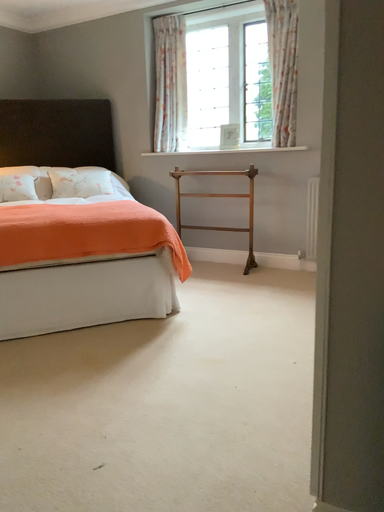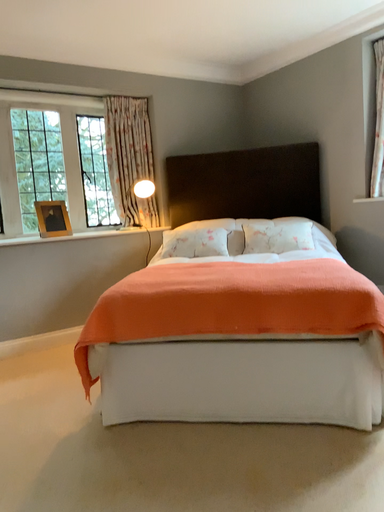
Question: Which way did the camera rotate in the video?

Choices:
 (A) rotated upward
 (B) rotated downward

Answer: (A)